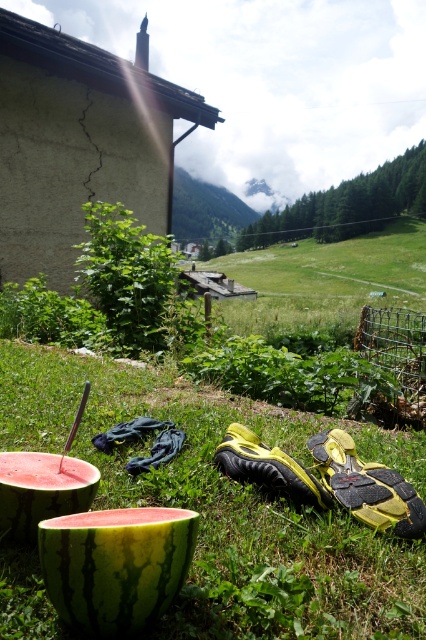
You are a gardener who wants to plant a new flower bed between the green grass at center and the ripe red watermelon at lower left. Which area should you choose to ensure the flowers will have enough space to grow?

The green grass at center is taller than the ripe red watermelon at lower left, so you should plant the flowers in the green grass at center area because it has more space for growth.

You are planning to pack both the green rind watermelon at lower center and the ripe red watermelon at lower left into a basket that can only hold one watermelon at a time. Which watermelon should you choose to ensure it fits in the basket?

The ripe red watermelon at lower left should be chosen because the green rind watermelon at lower center might be wider and thus may not fit in the basket designed for one watermelon.

You are a gardener who wants to place a new plant pot between the green grass at center and the green rind watermelon at lower center. The plant pot is 30 centimeters in diameter. Will there be enough space to place it without overlapping either object?

The distance between the green grass at center and the green rind watermelon at lower center is 41.59 centimeters. Since the plant pot is 30 centimeters in diameter, which is smaller than the distance between them, there is enough space to place it without overlapping either object.